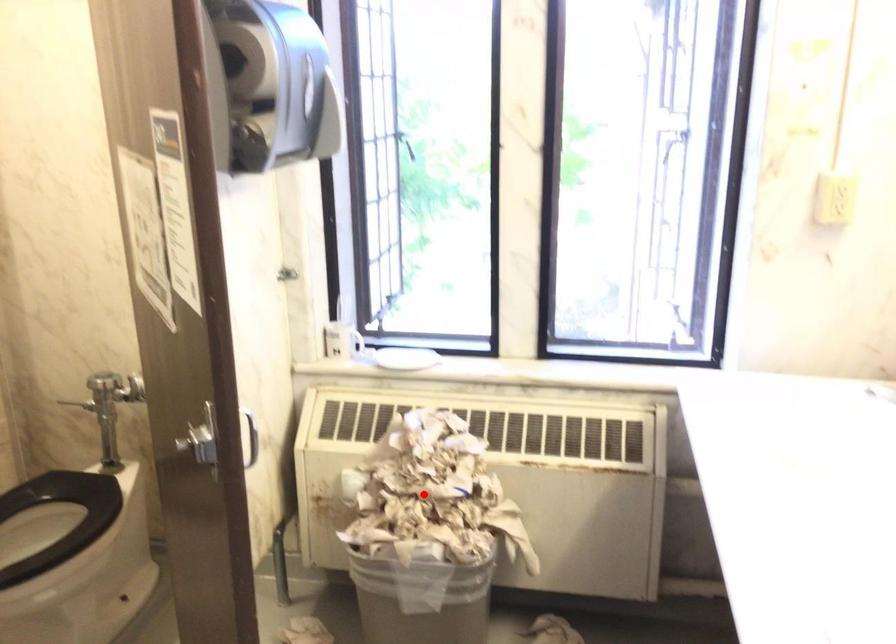
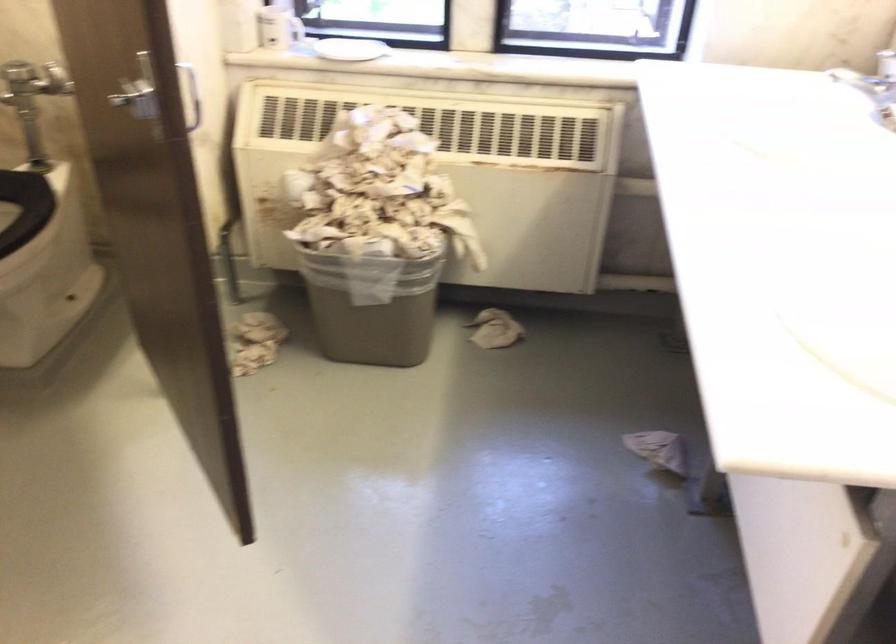
Locate, in the second image, the point that corresponds to the highlighted location in the first image.

(373, 192)